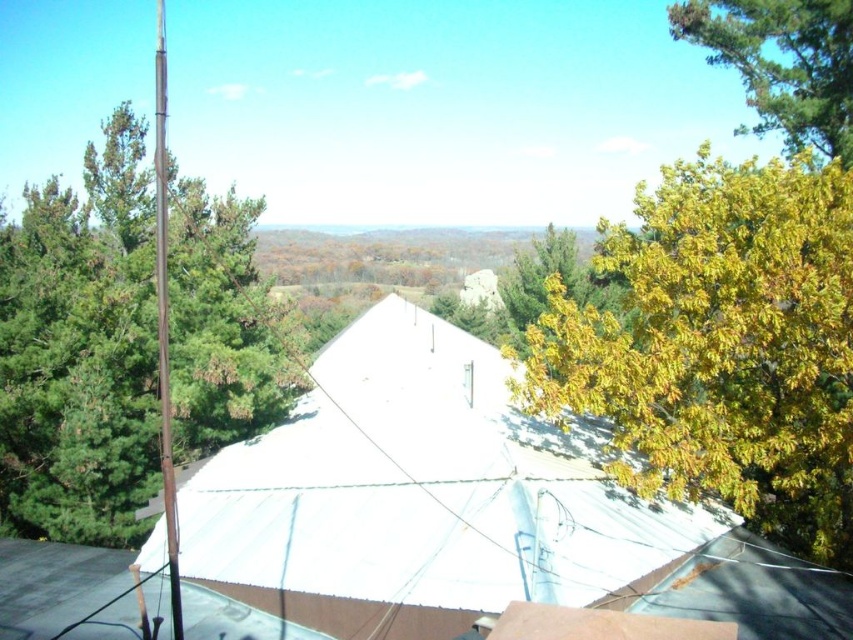
Can you confirm if green pine tree at left is taller than green leafy tree at upper right?

Yes, green pine tree at left is taller than green leafy tree at upper right.

Locate an element on the screen. The width and height of the screenshot is (853, 640). green pine tree at left is located at coordinates (80, 349).

Is point (225, 444) positioned after point (775, 81)?

Yes.

This screenshot has height=640, width=853. What are the coordinates of `green pine tree at left` in the screenshot? It's located at (80, 349).

Can you confirm if white matte canopy at center is positioned below green leafy tree at upper right?

Yes, white matte canopy at center is below green leafy tree at upper right.

Locate an element on the screen. white matte canopy at center is located at coordinates click(x=421, y=496).

I want to click on white matte canopy at center, so click(421, 496).

Is yellow-green leaves at right below green leafy tree at upper right?

Yes.

Which is more to the right, yellow-green leaves at right or green leafy tree at upper right?

From the viewer's perspective, green leafy tree at upper right appears more on the right side.

Which is behind, point (753, 451) or point (833, 113)?

Point (833, 113)

I want to click on yellow-green leaves at right, so click(720, 346).